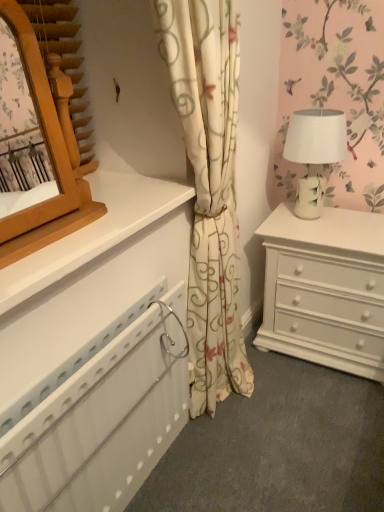
I want to click on wooden mirror at upper left, so click(x=49, y=158).

Measure the distance between point (213, 318) and camera.

The distance of point (213, 318) from camera is 5.11 feet.

What is the approximate width of white floral curtain at center?

white floral curtain at center is 8.30 inches wide.

Where is `wooden mirror at upper left`? wooden mirror at upper left is located at coordinates (49, 158).

From their relative heights in the image, would you say wooden mirror at upper left is taller or shorter than white plastic radiator at lower left?

wooden mirror at upper left is shorter than white plastic radiator at lower left.

Which of these two, wooden mirror at upper left or white plastic radiator at lower left, is thinner?

Thinner between the two is wooden mirror at upper left.

Is there a large distance between wooden mirror at upper left and white plastic radiator at lower left?

wooden mirror at upper left is near white plastic radiator at lower left, not far away.

Is wooden mirror at upper left at the right side of white plastic radiator at lower left?

No, wooden mirror at upper left is not to the right of white plastic radiator at lower left.

Is white plastic radiator at lower left facing towards wooden mirror at upper left?

No, white plastic radiator at lower left is not aimed at wooden mirror at upper left.

Looking at this image, considering their positions, is white plastic radiator at lower left located in front of or behind wooden mirror at upper left?

Clearly, white plastic radiator at lower left is behind wooden mirror at upper left.

Would you say white floral curtain at center is inside or outside wooden mirror at upper left?

white floral curtain at center cannot be found inside wooden mirror at upper left.

Considering their positions, is white floral curtain at center located in front of or behind wooden mirror at upper left?

In the image, white floral curtain at center appears behind wooden mirror at upper left.

Considering the relative sizes of white floral curtain at center and wooden mirror at upper left in the image provided, is white floral curtain at center taller than wooden mirror at upper left?

Yes, white floral curtain at center is taller than wooden mirror at upper left.

Is white ceramic table lamp at right completely or partially inside white plastic radiator at lower left?

No, white ceramic table lamp at right is not inside white plastic radiator at lower left.

Does white plastic radiator at lower left turn towards white ceramic table lamp at right?

No, white plastic radiator at lower left is not facing towards white ceramic table lamp at right.

The image size is (384, 512). I want to click on chest of drawers that appears on the left of white ceramic table lamp at right, so click(95, 350).

Considering their positions, is white plastic radiator at lower left located in front of or behind white ceramic table lamp at right?

In the image, white plastic radiator at lower left appears in front of white ceramic table lamp at right.

Is point (343, 143) closer or farther from the camera than point (98, 215)?

Point (343, 143).

Is white ceramic table lamp at right oriented away from wooden mirror at upper left?

No.

Considering their positions, is white ceramic table lamp at right located in front of or behind wooden mirror at upper left?

Clearly, white ceramic table lamp at right is behind wooden mirror at upper left.

Between white floral curtain at center and white ceramic table lamp at right, which one is positioned behind?

white ceramic table lamp at right is further away from the camera.

Is white floral curtain at center wider or thinner than white ceramic table lamp at right?

Clearly, white floral curtain at center has less width compared to white ceramic table lamp at right.

Can you confirm if white floral curtain at center is positioned to the right of white ceramic table lamp at right?

No, white floral curtain at center is not to the right of white ceramic table lamp at right.

Is white floral curtain at center outside of white ceramic table lamp at right?

Indeed, white floral curtain at center is completely outside white ceramic table lamp at right.

Is wooden mirror at upper left at the left side of white ceramic table lamp at right?

Indeed, wooden mirror at upper left is positioned on the left side of white ceramic table lamp at right.

Looking at their sizes, would you say wooden mirror at upper left is wider or thinner than white ceramic table lamp at right?

Clearly, wooden mirror at upper left has less width compared to white ceramic table lamp at right.

Is wooden mirror at upper left inside the boundaries of white ceramic table lamp at right, or outside?

The correct answer is: outside.

Which is nearer, (80, 192) or (307, 152)?

Point (80, 192) is closer to the camera than point (307, 152).

Locate an element on the screen. This screenshot has height=512, width=384. chest of drawers behind the wooden mirror at upper left is located at coordinates (95, 350).

Where is `mirror above the white plastic radiator at lower left (from a real-world perspective)`? mirror above the white plastic radiator at lower left (from a real-world perspective) is located at coordinates (49, 158).

Based on their spatial positions, is white floral curtain at center or white ceramic table lamp at right further from white plastic radiator at lower left?

white ceramic table lamp at right.

Estimate the real-world distances between objects in this image. Which object is closer to white ceramic table lamp at right, white floral curtain at center or wooden mirror at upper left?

white floral curtain at center lies closer to white ceramic table lamp at right than the other object.

Consider the image. From the image, which object appears to be nearer to white floral curtain at center, white plastic radiator at lower left or white ceramic table lamp at right?

white plastic radiator at lower left.

Which object lies further to the anchor point white floral curtain at center, white ceramic table lamp at right or wooden mirror at upper left?

Based on the image, white ceramic table lamp at right appears to be further to white floral curtain at center.

From the image, which object appears to be farther from white plastic radiator at lower left, white floral curtain at center or wooden mirror at upper left?

white floral curtain at center lies further to white plastic radiator at lower left than the other object.

Which object lies nearer to the anchor point white ceramic table lamp at right, white plastic radiator at lower left or wooden mirror at upper left?

white plastic radiator at lower left is closer to white ceramic table lamp at right.

From the image, which object appears to be farther from white ceramic table lamp at right, white floral curtain at center or white plastic radiator at lower left?

Based on the image, white plastic radiator at lower left appears to be further to white ceramic table lamp at right.

When comparing their distances from white plastic radiator at lower left, does wooden mirror at upper left or white ceramic table lamp at right seem further?

white ceramic table lamp at right lies further to white plastic radiator at lower left than the other object.

Locate an element on the screen. This screenshot has width=384, height=512. curtain between wooden mirror at upper left and white plastic radiator at lower left vertically is located at coordinates (209, 187).

Identify the location of chest of drawers between wooden mirror at upper left and white ceramic table lamp at right in the front-back direction. (95, 350).

The width and height of the screenshot is (384, 512). I want to click on curtain between white plastic radiator at lower left and white ceramic table lamp at right from front to back, so click(x=209, y=187).

Where is `curtain between wooden mirror at upper left and white ceramic table lamp at right from front to back`? This screenshot has height=512, width=384. curtain between wooden mirror at upper left and white ceramic table lamp at right from front to back is located at coordinates (209, 187).